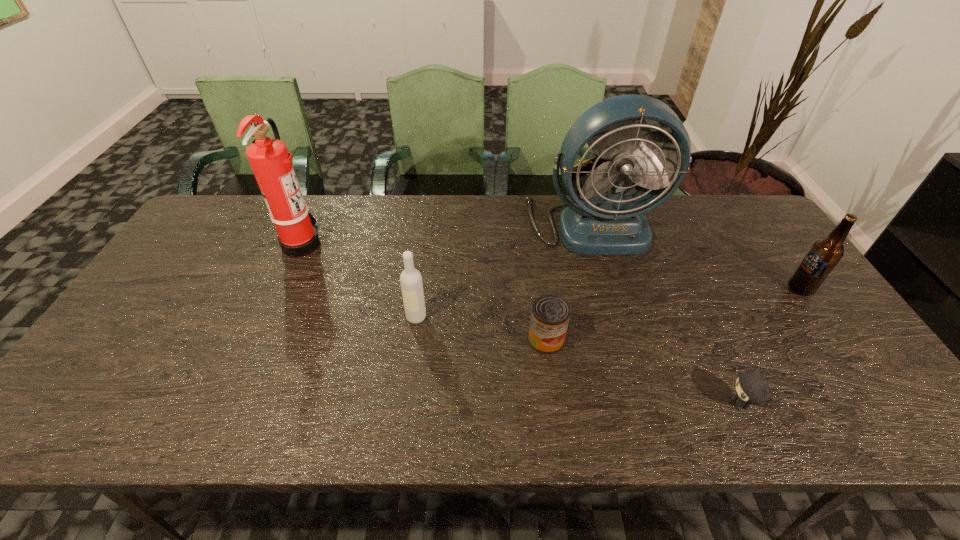
At what (x,y) coordinates should I click in order to perform the action: click on fan. Please return your answer as a coordinate pair (x, y). Looking at the image, I should click on (599, 223).

I want to click on fire extinguisher, so click(x=270, y=160).

Find the location of a particular element. The height and width of the screenshot is (540, 960). the fourth nearest object is located at coordinates (823, 256).

Identify the location of the rightmost object. (823, 256).

I want to click on the third nearest object, so click(411, 283).

Image resolution: width=960 pixels, height=540 pixels. What are the coordinates of `vodka` in the screenshot? It's located at [411, 283].

Find the location of a particular element. Image resolution: width=960 pixels, height=540 pixels. the fifth farthest object is located at coordinates (550, 314).

Locate an element on the screen. This screenshot has height=540, width=960. kitten is located at coordinates (751, 388).

The image size is (960, 540). Find the location of `the shortest object`. the shortest object is located at coordinates (751, 388).

This screenshot has width=960, height=540. I want to click on free spot located 0.220m in front of the fan to blow air, so click(x=617, y=311).